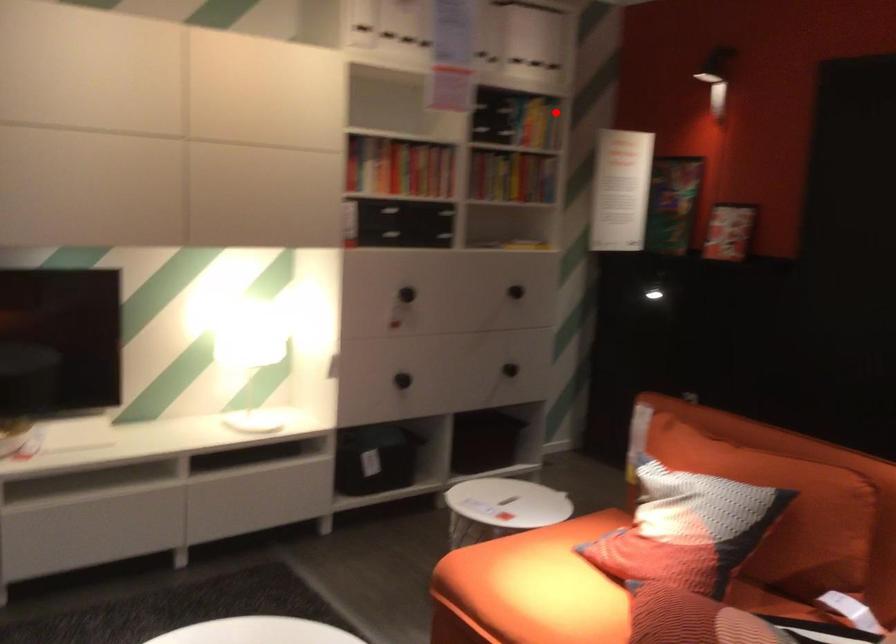
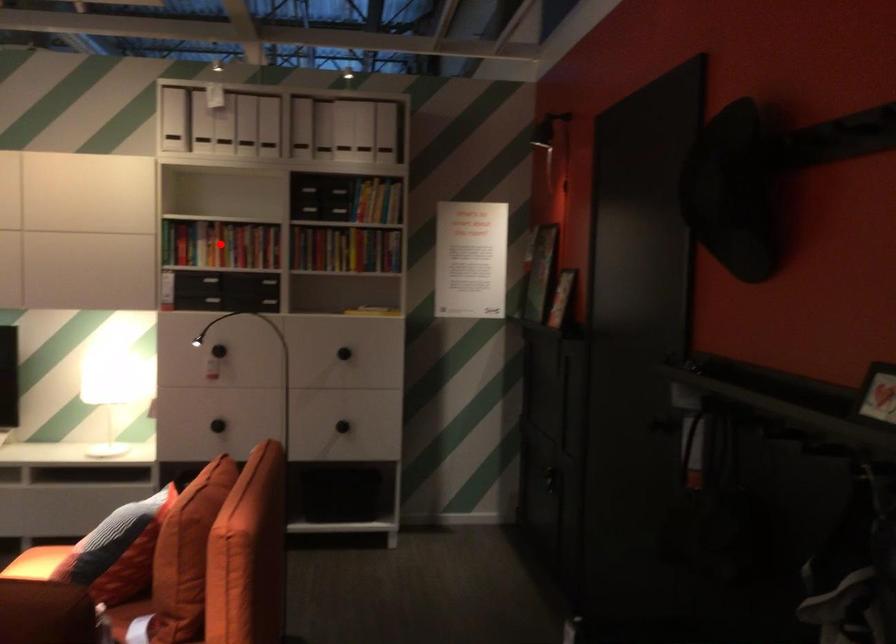
I am providing you with two images of the same scene from different viewpoints. A red point is marked on the first image and another point is marked on the second image. Do the highlighted points in image1 and image2 indicate the same real-world spot?

No